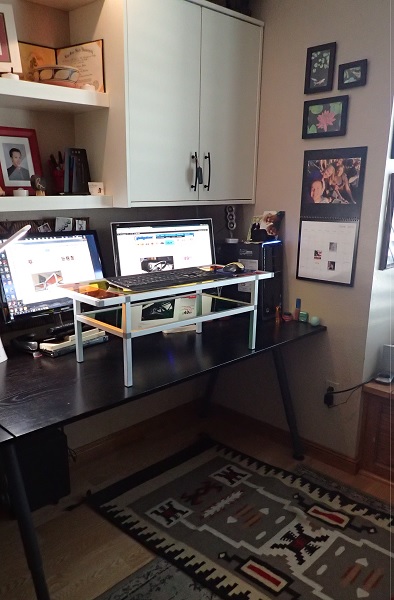
The image size is (394, 600). Find the location of `wooden floor`. wooden floor is located at coordinates click(98, 559).